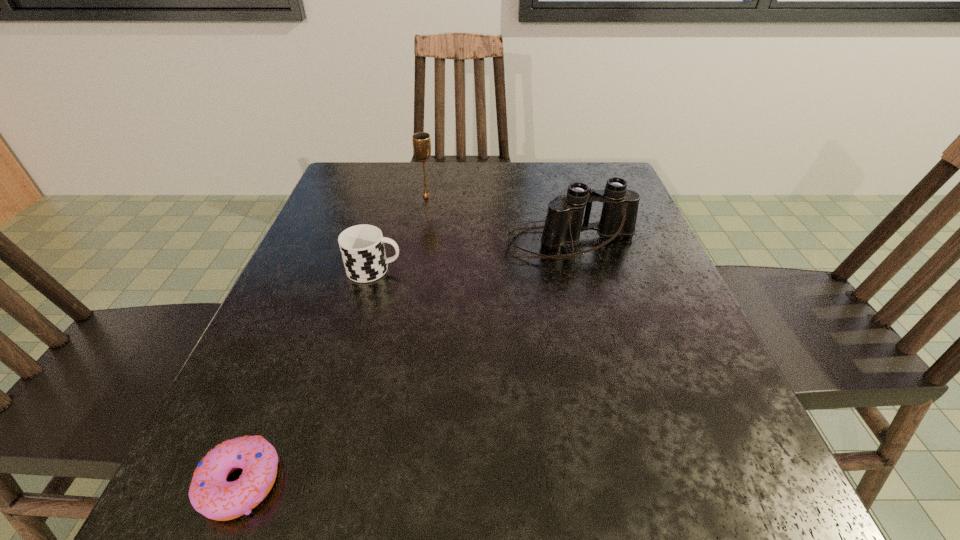
Image resolution: width=960 pixels, height=540 pixels. Find the location of `vacant space at the near left corner of the desktop`. vacant space at the near left corner of the desktop is located at coordinates (267, 523).

In the image, there is a desktop. At what (x,y) coordinates should I click in order to perform the action: click on free space at the far right corner. Please return your answer as a coordinate pair (x, y). This screenshot has width=960, height=540. Looking at the image, I should click on (587, 172).

Locate an element on the screen. The image size is (960, 540). free space at the near right corner of the desktop is located at coordinates (721, 494).

Where is `free space between the chalice and the second shortest object`? This screenshot has height=540, width=960. free space between the chalice and the second shortest object is located at coordinates (400, 233).

Image resolution: width=960 pixels, height=540 pixels. Identify the location of free space between the doughnut and the binoculars. (405, 363).

Image resolution: width=960 pixels, height=540 pixels. Identify the location of free space between the chalice and the nearest object. (333, 339).

Find the location of a particular element. Image resolution: width=960 pixels, height=540 pixels. unoccupied area between the nearest object and the second shortest object is located at coordinates (307, 376).

You are a GUI agent. You are given a task and a screenshot of the screen. Output one action in this format:
    pyautogui.click(x=<x>, y=<y>)
    Task: Click on the vacant area that lies between the cup and the shortest object
    The height and width of the screenshot is (540, 960).
    Given the screenshot: What is the action you would take?
    pyautogui.click(x=307, y=376)

Find the location of a particular element. The width and height of the screenshot is (960, 540). unoccupied position between the third tallest object and the binoculars is located at coordinates (472, 256).

Where is `blank region between the farthest object and the nearest object`? The height and width of the screenshot is (540, 960). blank region between the farthest object and the nearest object is located at coordinates (333, 339).